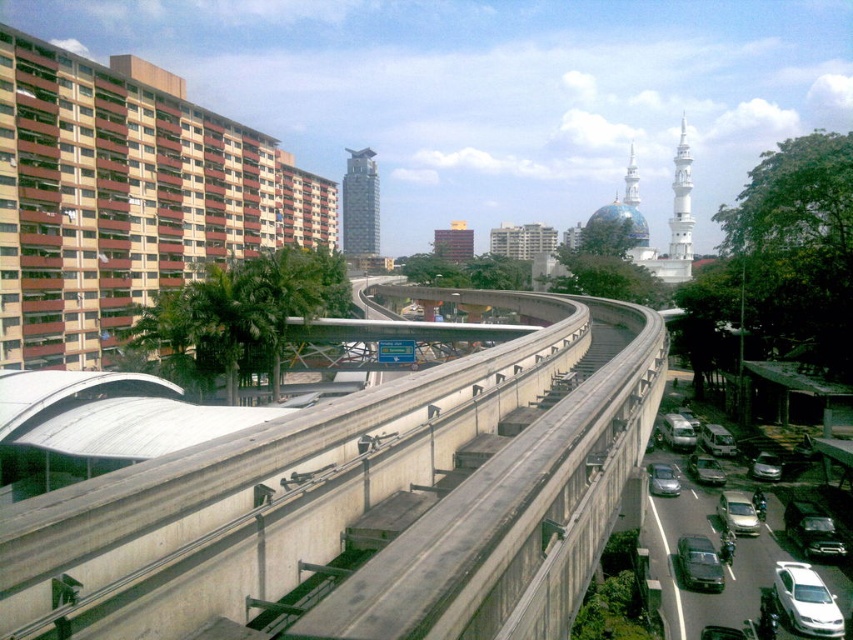
You are a delivery driver who needs to park your matte black sedan at center in a designated parking spot located at coordinates 0.9, 0.8. Will your vehicle fit perfectly into the spot?

The matte black sedan at center is positioned at point (698, 564), which is very close to the parking spot at (682, 576). The slight difference in coordinates suggests the vehicle is nearly aligned but might require minor adjustments to fit perfectly into the spot.